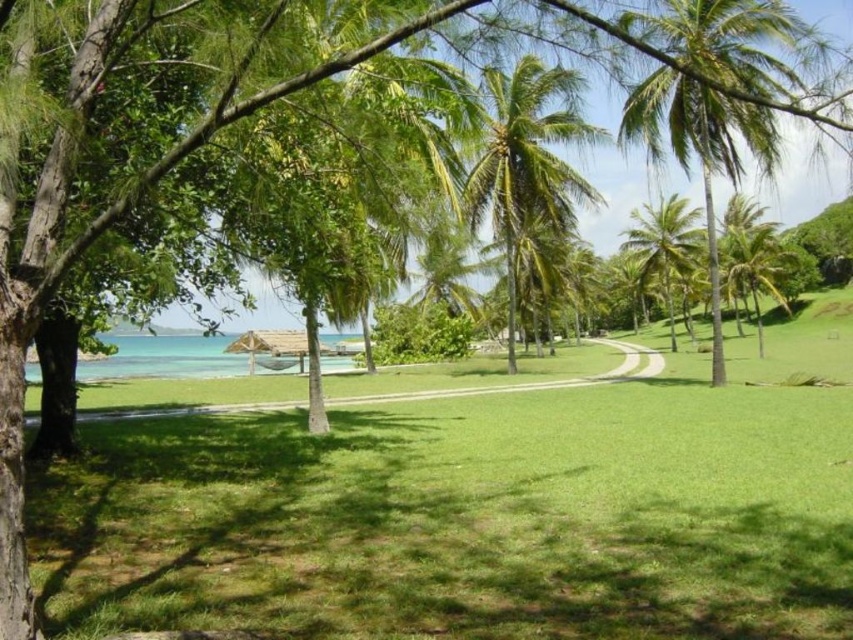
Does green leafy palm tree at upper right have a lesser height compared to green leafy palm tree at center?

Indeed, green leafy palm tree at upper right has a lesser height compared to green leafy palm tree at center.

This screenshot has width=853, height=640. Describe the element at coordinates (712, 99) in the screenshot. I see `green leafy palm tree at upper right` at that location.

Between point (674, 52) and point (550, 156), which one is positioned behind?

Positioned behind is point (550, 156).

At what (x,y) coordinates should I click in order to perform the action: click on green leafy palm tree at upper right. Please return your answer as a coordinate pair (x, y). The height and width of the screenshot is (640, 853). Looking at the image, I should click on (712, 99).

Does point (132, 365) lie behind point (643, 228)?

No, (132, 365) is in front of (643, 228).

Locate an element on the screen. clear blue water at lower left is located at coordinates (164, 356).

Does green leafy palm tree at right have a smaller size compared to green leafy palm tree at center-right?

No.

Between green leafy palm tree at right and green leafy palm tree at center-right, which one appears on the right side from the viewer's perspective?

green leafy palm tree at right is more to the right.

The height and width of the screenshot is (640, 853). Identify the location of green leafy palm tree at right. (752, 257).